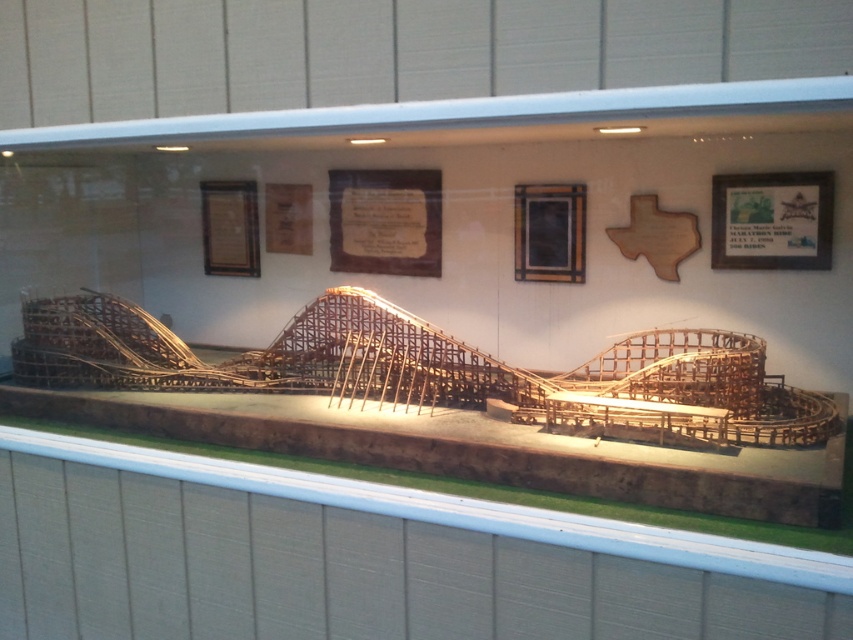
Who is positioned more to the left, matte wood plaque at center or wooden frame at center?

matte wood plaque at center

This screenshot has height=640, width=853. What do you see at coordinates (386, 221) in the screenshot?
I see `matte wood plaque at center` at bounding box center [386, 221].

Identify the location of matte wood plaque at center. 386,221.

Is wooden plaque at upper right below wooden frame at center?

Incorrect, wooden plaque at upper right is not positioned below wooden frame at center.

Does point (759, 252) lie behind point (547, 205)?

No.

Locate an element on the screen. This screenshot has height=640, width=853. wooden plaque at upper right is located at coordinates click(x=772, y=220).

Is matte wood plaque at center closer to camera compared to wooden plaque at upper right?

That is False.

Is point (439, 218) positioned in front of point (785, 232)?

No, (439, 218) is further to viewer.

This screenshot has width=853, height=640. In order to click on matte wood plaque at center in this screenshot , I will do `click(386, 221)`.